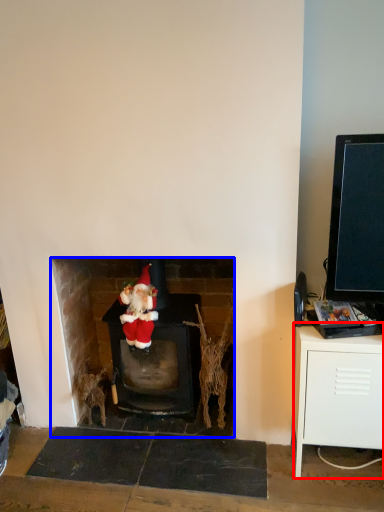
Question: Which object appears closest to the camera in this image, table (highlighted by a red box) or fireplace (highlighted by a blue box)?

Choices:
 (A) table
 (B) fireplace

Answer: (A)